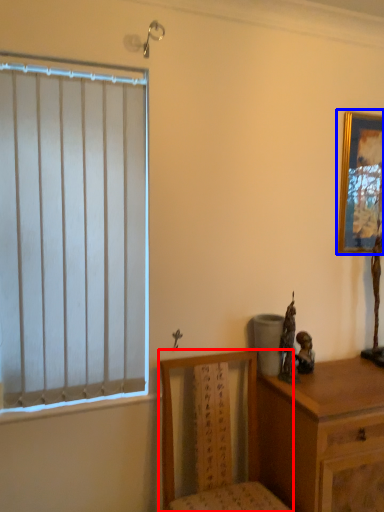
Question: Which of the following is the closest to the observer, chair (highlighted by a red box) or picture frame (highlighted by a blue box)?

Choices:
 (A) chair
 (B) picture frame

Answer: (A)